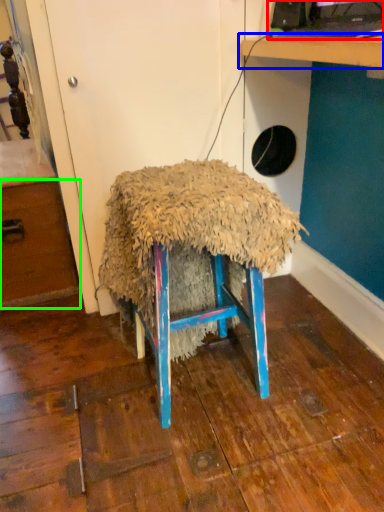
Question: Which object is positioned farthest from desktop computer (highlighted by a red box)? Select from table (highlighted by a blue box) and drawer (highlighted by a green box).

Choices:
 (A) table
 (B) drawer

Answer: (B)